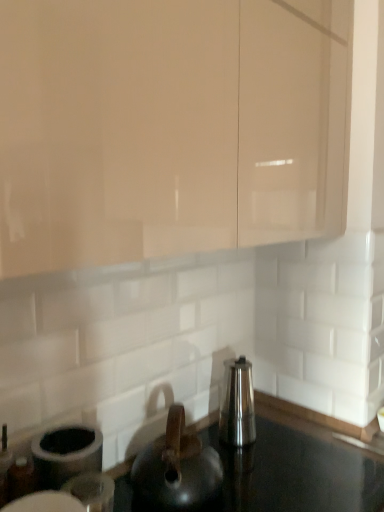
This screenshot has width=384, height=512. Find the location of `space that is in front of satin silver kettle at center`. space that is in front of satin silver kettle at center is located at coordinates (271, 470).